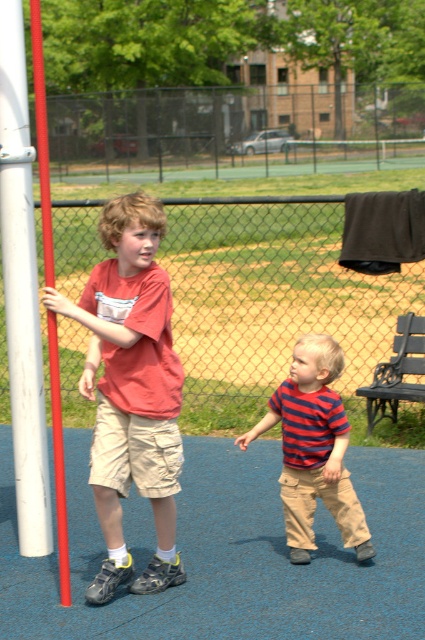
Does striped cotton shirt at center have a lesser width compared to white smooth pole at left?

Correct, striped cotton shirt at center's width is less than white smooth pole at left's.

Locate an element on the screen. The width and height of the screenshot is (425, 640). striped cotton shirt at center is located at coordinates (314, 449).

The width and height of the screenshot is (425, 640). Find the location of `striped cotton shirt at center`. striped cotton shirt at center is located at coordinates (314, 449).

Looking at this image, which is more to the right, matte red t-shirt at left or white smooth pole at left?

matte red t-shirt at left

Can you confirm if matte red t-shirt at left is bigger than white smooth pole at left?

No.

Locate an element on the screen. matte red t-shirt at left is located at coordinates (130, 388).

Can you confirm if matte red t-shirt at left is positioned below striped cotton shirt at center?

No.

Is matte red t-shirt at left bigger than striped cotton shirt at center?

Yes.

Does point (150, 285) come closer to viewer compared to point (348, 440)?

That is True.

Identify the location of matte red t-shirt at left. (130, 388).